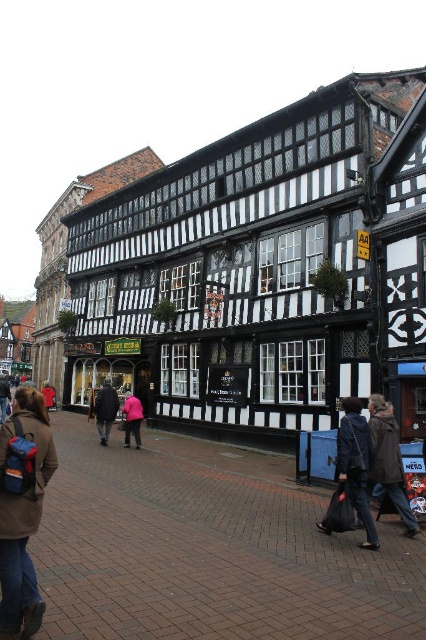
Question: Which point is closer to the camera?

Choices:
 (A) (313, 556)
 (B) (20, 611)
 (C) (0, 406)

Answer: (B)

Question: Is brown fabric jacket at lower left wider than dark brown fur coat at center?

Choices:
 (A) yes
 (B) no

Answer: (A)

Question: Does brown fabric jacket at lower left appear on the left side of dark brown leather jacket at center?

Choices:
 (A) yes
 (B) no

Answer: (B)

Question: Can you confirm if brown fabric jacket at lower left is thinner than brown leather jacket at lower left?

Choices:
 (A) yes
 (B) no

Answer: (A)

Question: Which object appears farthest from the camera in this image?

Choices:
 (A) dark blue fabric jacket at lower right
 (B) red jacket at center
 (C) dark brown fur coat at center

Answer: (C)

Question: Among these objects, which one is farthest from the camera?

Choices:
 (A) dark blue fabric jacket at lower right
 (B) brown leather jacket at lower left
 (C) pink fabric person at center

Answer: (B)